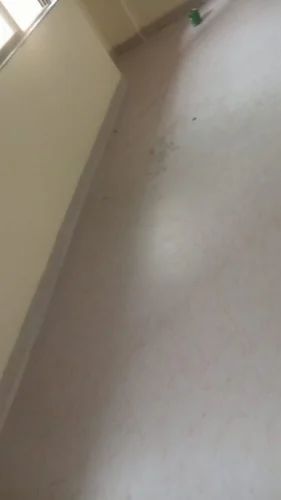
Locate an element on the screen. paint is located at coordinates (2, 343), (15, 350), (55, 280), (83, 187), (118, 99), (132, 57), (250, 161), (216, 294), (15, 72).